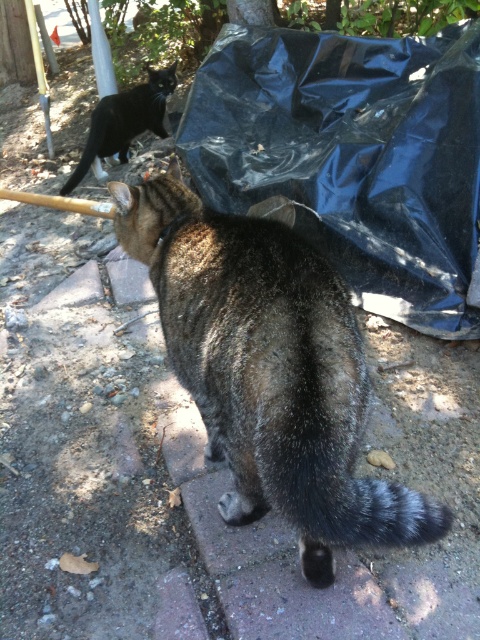
Consider the image. You are standing at the point marked by the coordinates point (268, 369). Looking around, you see a tabby fur cat at center and a black cat walking away from you near a large black tarp. Which cat is closer to your current position?

The tabby fur cat at center is closer to your current position because the point (268, 369) indicates its location.